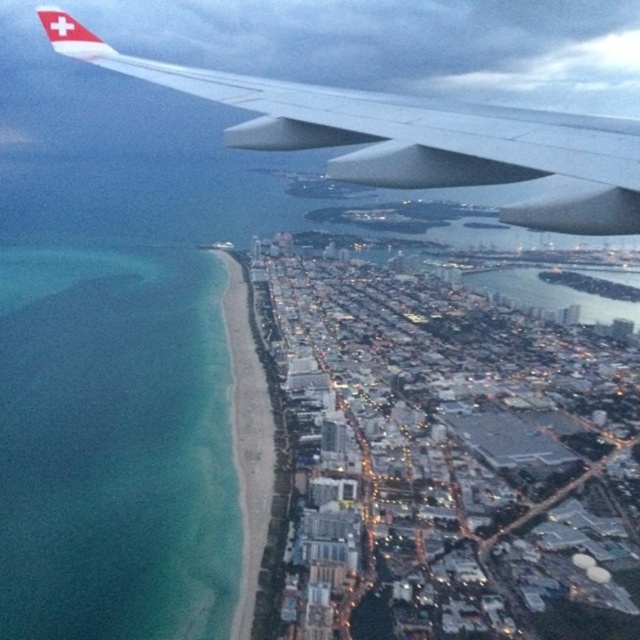
Can you confirm if teal smooth water at lower left is positioned to the right of beach sand at lower left?

No, teal smooth water at lower left is not to the right of beach sand at lower left.

Who is more forward, (44, 257) or (227, 332)?

Point (227, 332)

Find the location of a particular element. teal smooth water at lower left is located at coordinates (115, 445).

Who is more distant from viewer, (472, 172) or (237, 380)?

Point (237, 380)

I want to click on white matte airplane wing at upper left, so click(x=410, y=136).

Which is behind, point (253, 106) or point (234, 358)?

The point (234, 358) is more distant.

What are the coordinates of `white matte airplane wing at upper left` in the screenshot? It's located at (410, 136).

Which is behind, point (180, 278) or point (522, 132)?

The point (180, 278) is behind.

Does teal smooth water at lower left have a lesser width compared to white matte airplane wing at upper left?

Yes, teal smooth water at lower left is thinner than white matte airplane wing at upper left.

In order to click on teal smooth water at lower left in this screenshot , I will do `click(115, 445)`.

This screenshot has height=640, width=640. In order to click on teal smooth water at lower left in this screenshot , I will do `click(115, 445)`.